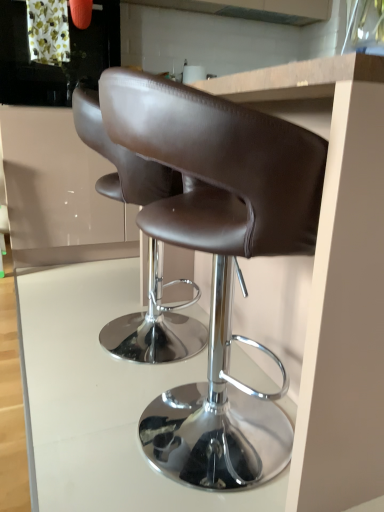
Question: From a real-world perspective, is brown leather stool at center, which appears as the second chair when viewed from the back, physically located above or below matte white cabinet at upper left?

Choices:
 (A) below
 (B) above

Answer: (A)

Question: From their relative heights in the image, would you say brown leather stool at center, which is counted as the 1th chair, starting from the front, is taller or shorter than matte white cabinet at upper left?

Choices:
 (A) short
 (B) tall

Answer: (A)

Question: Considering the real-world distances, which object is closest to the white glossy table at center?

Choices:
 (A) brown leather stool at center, which appears as the 1th chair when viewed from the back
 (B) matte white cabinet at upper left
 (C) metallic gray exhaust hood at upper center
 (D) brown leather stool at center, which is counted as the 1th chair, starting from the front

Answer: (A)

Question: Which of these objects is positioned farthest from the matte white cabinet at upper left?

Choices:
 (A) white glossy table at center
 (B) brown leather stool at center, acting as the second chair starting from the front
 (C) brown leather stool at center, which appears as the second chair when viewed from the back
 (D) metallic gray exhaust hood at upper center

Answer: (D)